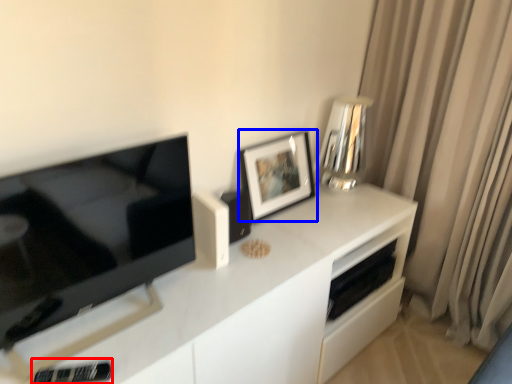
Question: Which object is closer to the camera taking this photo, appliance (highlighted by a red box) or picture frame (highlighted by a blue box)?

Choices:
 (A) appliance
 (B) picture frame

Answer: (A)